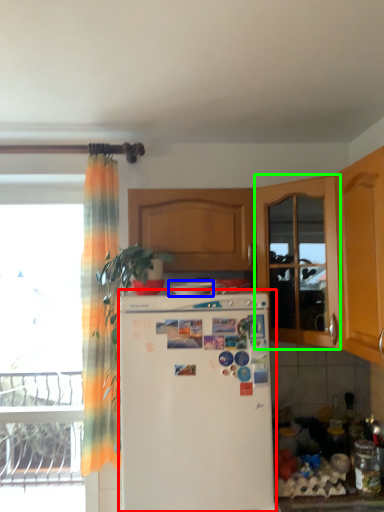
Question: Which object is the farthest from refrigerator (highlighted by a red box)? Choose among these: appliance (highlighted by a blue box) or screen door (highlighted by a green box).

Choices:
 (A) appliance
 (B) screen door

Answer: (B)